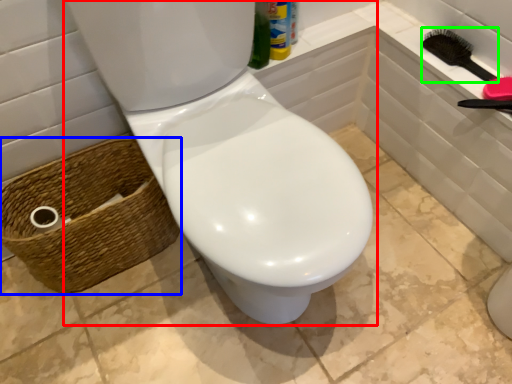
Question: Considering the real-world distances, which object is closest to toilet (highlighted by a red box)? basket (highlighted by a blue box) or brush (highlighted by a green box).

Choices:
 (A) basket
 (B) brush

Answer: (A)